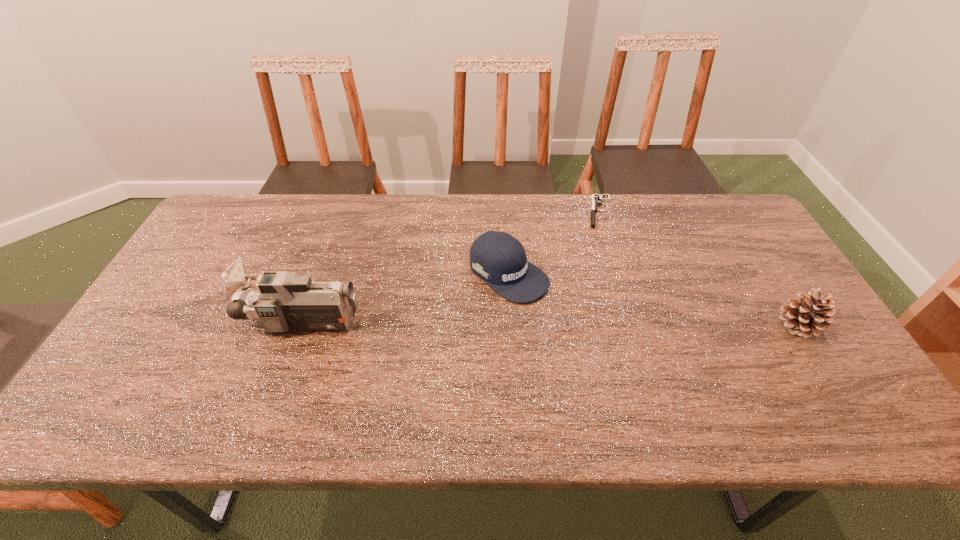
Locate an element on the screen. Image resolution: width=960 pixels, height=540 pixels. free space on the desktop that is between the camcorder and the pinecone and is positioned on the front-facing side of the third object from right to left is located at coordinates (577, 324).

You are a GUI agent. You are given a task and a screenshot of the screen. Output one action in this format:
    pyautogui.click(x=<x>, y=<y>)
    Task: Click on the free space on the desktop that is between the leftmost object and the pinecone and is positioned on the front-facing side of the shortest object
    The height and width of the screenshot is (540, 960).
    Given the screenshot: What is the action you would take?
    pyautogui.click(x=603, y=324)